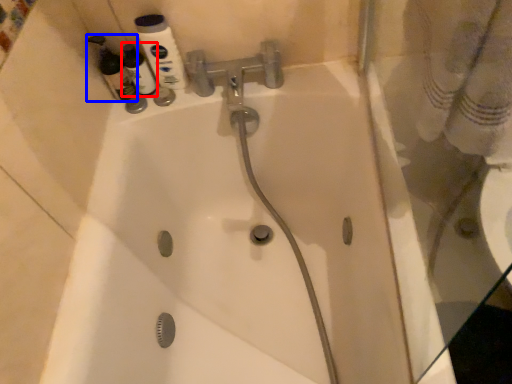
Question: Which of the following is the farthest to the observer, cleaning product (highlighted by a red box) or cleaning product (highlighted by a blue box)?

Choices:
 (A) cleaning product
 (B) cleaning product

Answer: (A)